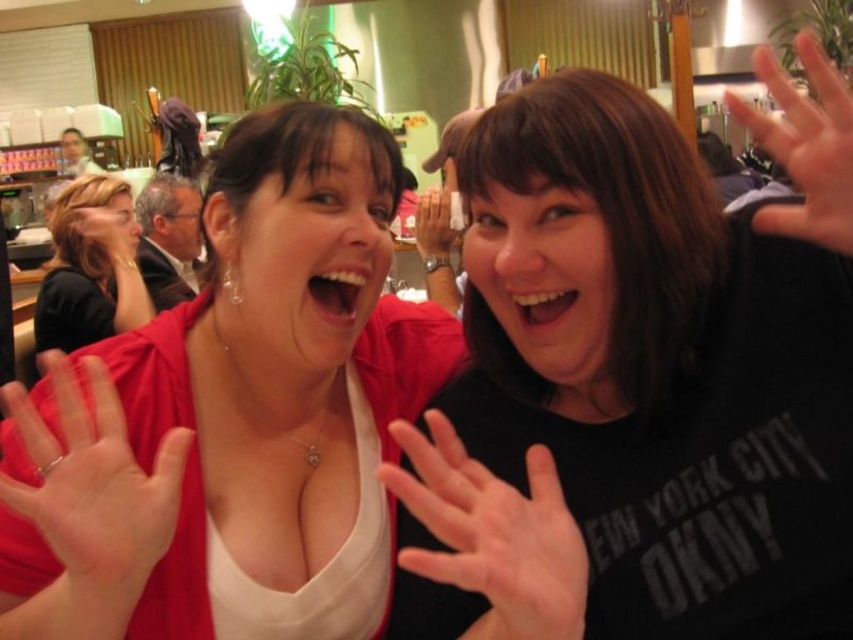
You are standing in front of the image and want to touch the two points marked in the scene. Which point, point 1 at coordinates point (775, 472) or point 2 at coordinates point (68, 237), is closer to you?

Point 1 at coordinates point (775, 472) is closer to the viewer than point 2 at coordinates point 0.082, 0.372.

Based on the scene description and the objects provided, what is the significance of the point at coordinates (639, 381)?

The point at coordinates (639, 381) corresponds to the black matte shirt at center, indicating its central position in the image.